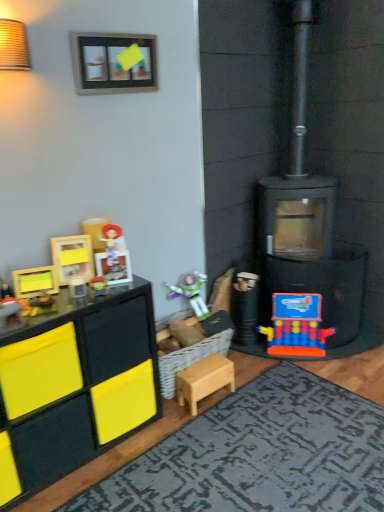
Where is `free location in front of light wood stool at center, marked as the 2th toy in a right-to-left arrangement`? The height and width of the screenshot is (512, 384). free location in front of light wood stool at center, marked as the 2th toy in a right-to-left arrangement is located at coordinates (218, 422).